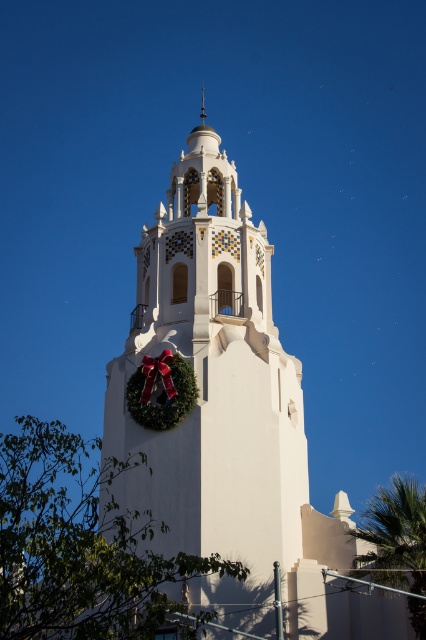
Is white matte tower at center to the left of green leafy palm tree at lower right from the viewer's perspective?

Yes, white matte tower at center is to the left of green leafy palm tree at lower right.

Can you confirm if white matte tower at center is positioned above green leafy palm tree at lower right?

Correct, white matte tower at center is located above green leafy palm tree at lower right.

Locate an element on the screen. This screenshot has width=426, height=640. white matte tower at center is located at coordinates (210, 387).

Where is `white matte tower at center`? The height and width of the screenshot is (640, 426). white matte tower at center is located at coordinates (210, 387).